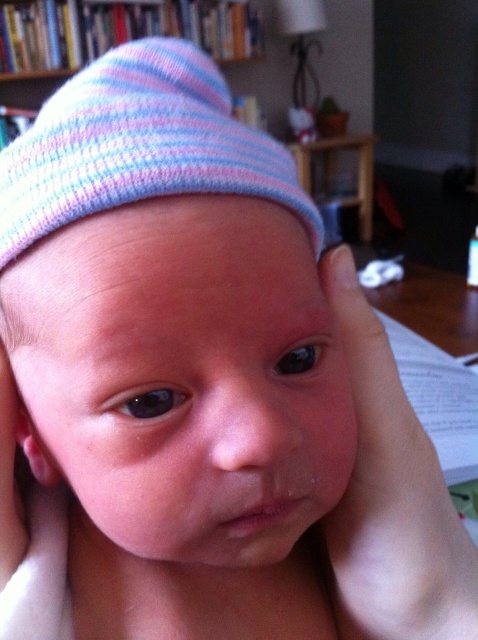
Question: Is smooth skin hand at center wider than knitted fabric bookshelf at upper center?

Choices:
 (A) yes
 (B) no

Answer: (B)

Question: Which point is closer to the camera?

Choices:
 (A) (339, 298)
 (B) (71, 13)

Answer: (A)

Question: Is smooth skin hand at center bigger than knitted fabric bookshelf at upper center?

Choices:
 (A) yes
 (B) no

Answer: (B)

Question: Is smooth skin hand at center to the left of knitted fabric bookshelf at upper center from the viewer's perspective?

Choices:
 (A) yes
 (B) no

Answer: (B)

Question: Among these points, which one is farthest from the camera?

Choices:
 (A) (379, 596)
 (B) (74, 0)

Answer: (B)

Question: Among these objects, which one is nearest to the camera?

Choices:
 (A) knitted fabric bookshelf at upper center
 (B) smooth skin hand at center

Answer: (B)